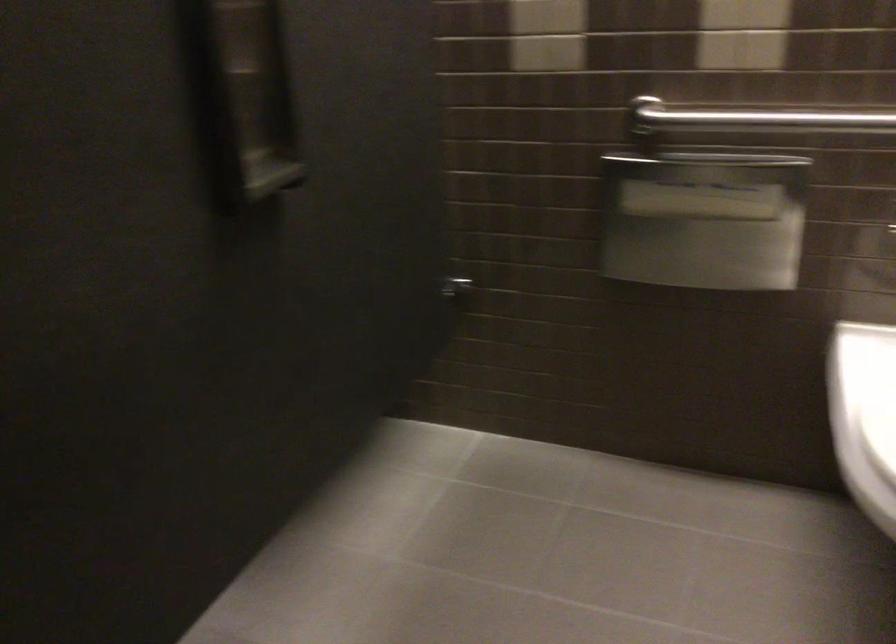
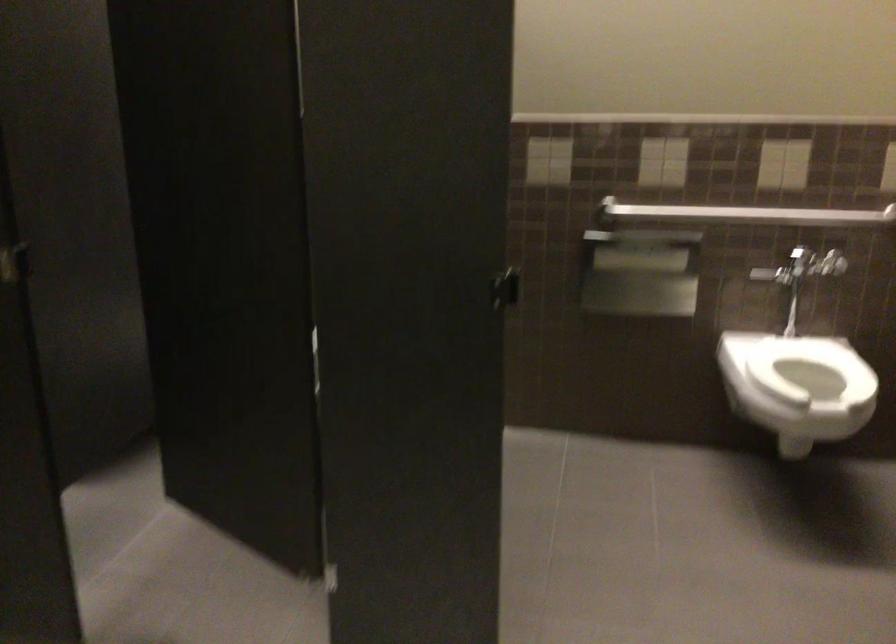
Which direction would the cameraman need to move to produce the second image?

The movement direction of the cameraman is left, backward.